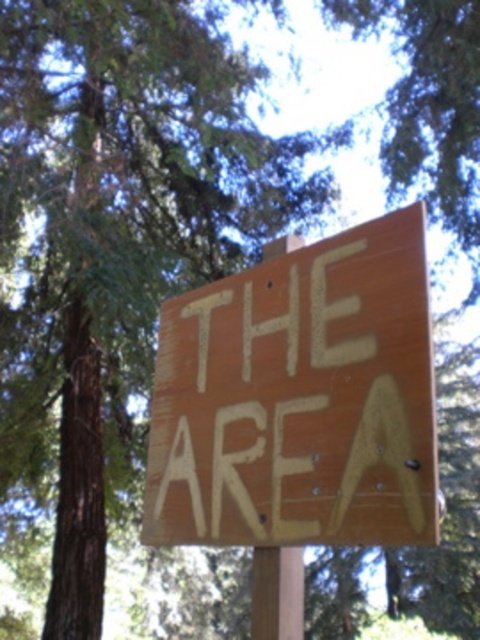
You are a painter who needs to know the relative sizes of objects in the scene to plan your painting. Which object, the wooden sign at center or the brown wood pole at center, is larger?

The wooden sign at center is bigger than the brown wood pole at center.

You are standing in a forest and see the wooden sign at center. If you want to take a photo of it from exactly 4 feet away, will you need to move closer or farther away?

The wooden sign at center is currently 4.13 feet away from the camera. Since you want to be exactly 4 feet away, you need to move slightly closer to reduce the distance by 0.13 feet.

You are a hiker who wants to read the text on the wooden sign at center. Since the brown wood pole at center is in the way, can you still read the text clearly?

The wooden sign at center is in front of the brown wood pole at center, so you can still read the text clearly because the sign is not blocked by the pole.